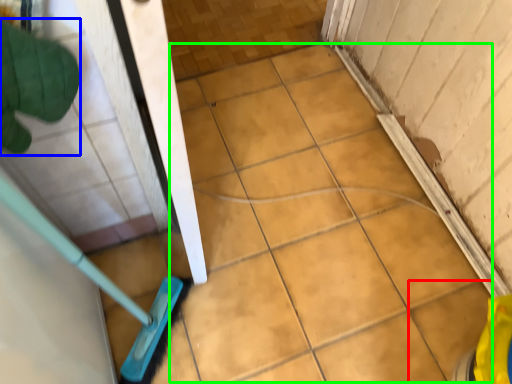
Question: Which object is positioned farthest from ceramic tile (highlighted by a red box)? Select from hand (highlighted by a blue box) and ceramic tile (highlighted by a green box).

Choices:
 (A) hand
 (B) ceramic tile

Answer: (A)